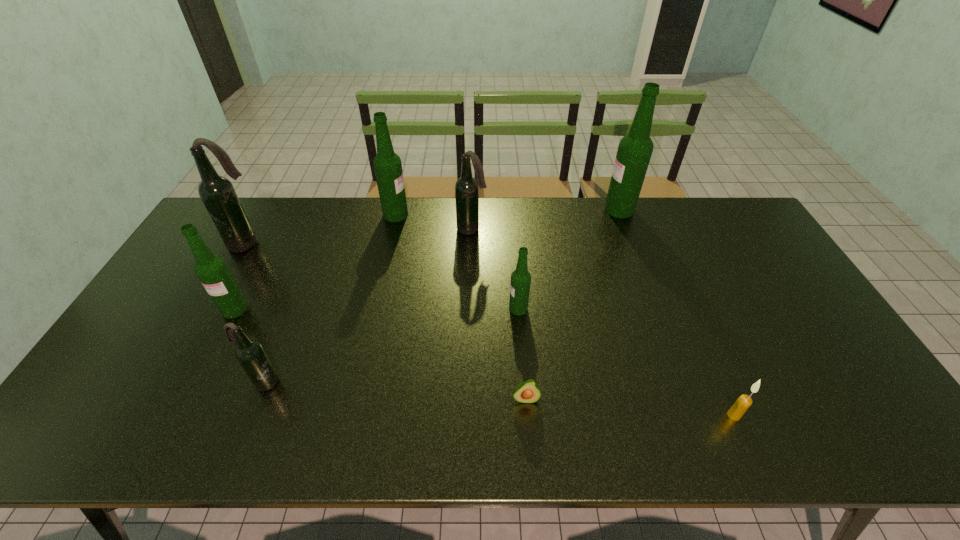
What are the coordinates of `green beer bottle that stands as the closest to the third object from left to right` in the screenshot? It's located at (212, 271).

Select which green beer bottle is the closest to the smallest green beer bottle. Please provide its 2D coordinates. Your answer should be formatted as a tuple, i.e. [(x, y)], where the tuple contains the x and y coordinates of a point satisfying the conditions above.

[(387, 164)]

Point out which dark beer bottle is positioned as the nearest to the second beer bottle from right to left. Please provide its 2D coordinates. Your answer should be formatted as a tuple, i.e. [(x, y)], where the tuple contains the x and y coordinates of a point satisfying the conditions above.

[(466, 188)]

Locate which dark beer bottle is the third closest to the second biggest green beer bottle. Please provide its 2D coordinates. Your answer should be formatted as a tuple, i.e. [(x, y)], where the tuple contains the x and y coordinates of a point satisfying the conditions above.

[(250, 353)]

You are a GUI agent. You are given a task and a screenshot of the screen. Output one action in this format:
    pyautogui.click(x=<x>, y=<y>)
    Task: Click on the vacant region that satisfies the following two spatial constraints: 1. on the label of the second green beer bottle from left to right; 2. on the label of the leftmost green beer bottle
    
    Given the screenshot: What is the action you would take?
    pyautogui.click(x=374, y=309)

Image resolution: width=960 pixels, height=540 pixels. I want to click on vacant area in the image that satisfies the following two spatial constraints: 1. on the label of the rightmost green beer bottle; 2. on the label of the third biggest green beer bottle, so click(x=657, y=309).

This screenshot has height=540, width=960. Find the location of `free space that satisfies the following two spatial constraints: 1. on the label of the eighth object from left to right; 2. on the cut side of the shortest object`. free space that satisfies the following two spatial constraints: 1. on the label of the eighth object from left to right; 2. on the cut side of the shortest object is located at coordinates (690, 399).

Find the location of a particular element. The height and width of the screenshot is (540, 960). vacant region that satisfies the following two spatial constraints: 1. on the label of the rightmost beer bottle; 2. on the label of the third biggest green beer bottle is located at coordinates (657, 309).

Image resolution: width=960 pixels, height=540 pixels. What are the coordinates of `free location that satisfies the following two spatial constraints: 1. on the label of the third smallest green beer bottle; 2. on the back side of the cream candle` in the screenshot? It's located at (351, 415).